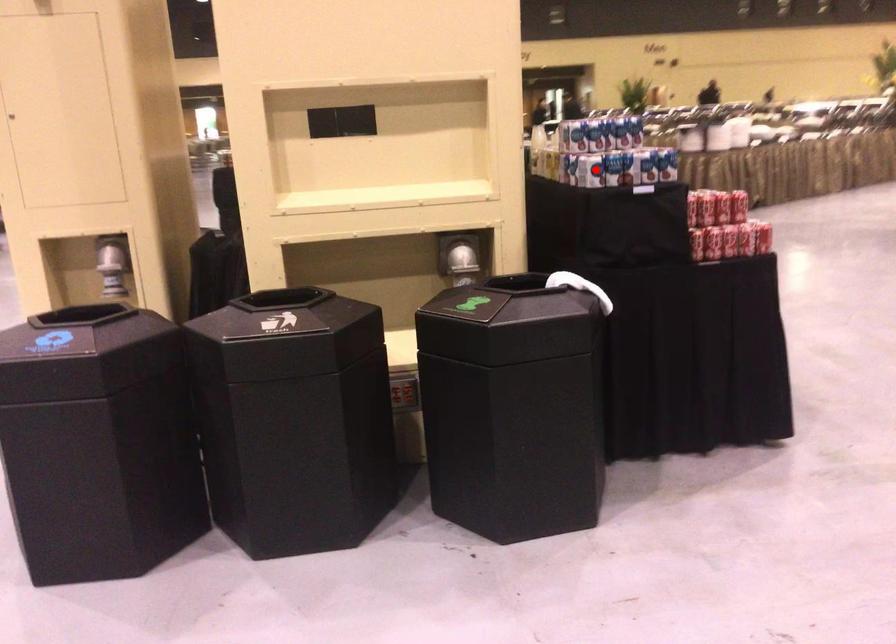
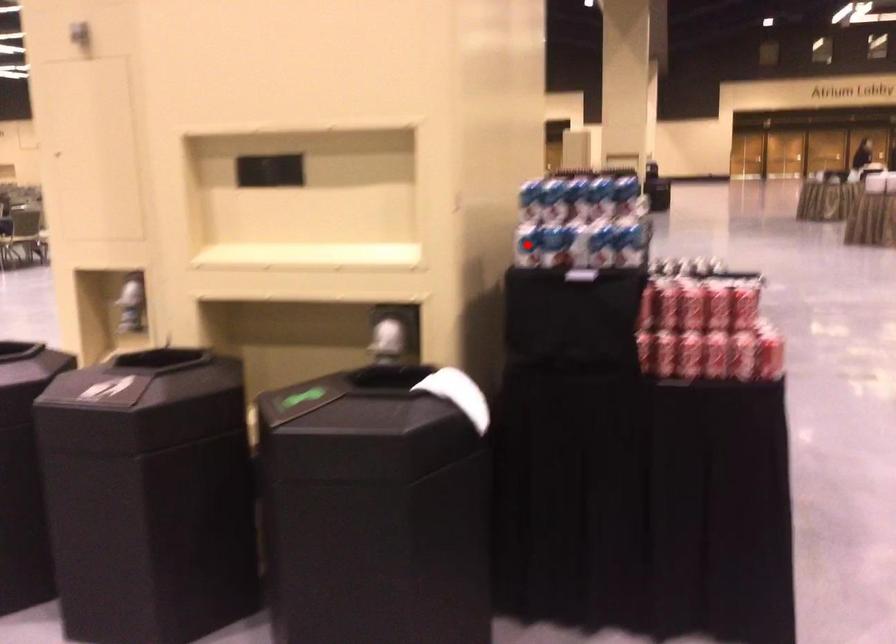
I am providing you with two images of the same scene from different viewpoints. A red point is marked on the first image and another point is marked on the second image. Do the highlighted points in image1 and image2 indicate the same real-world spot?

Yes